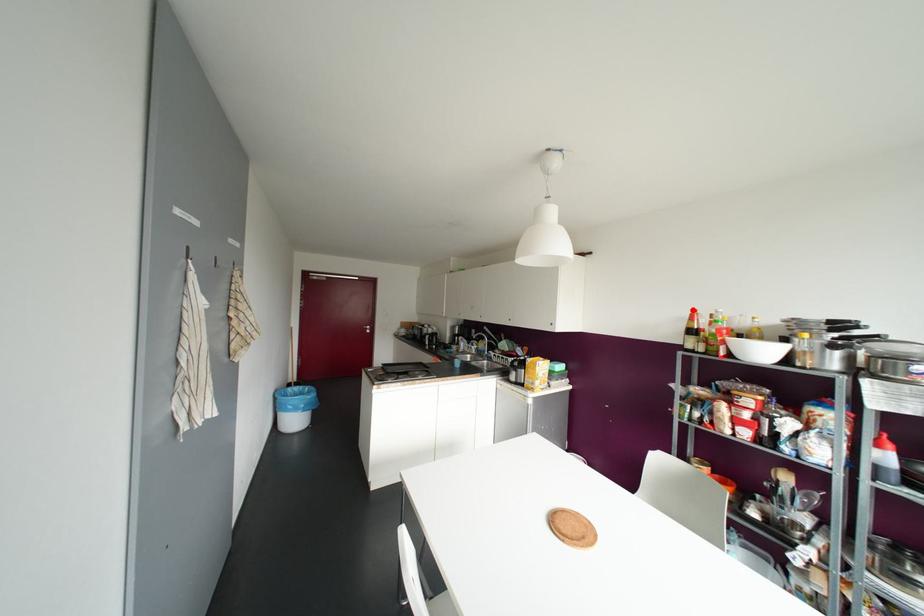
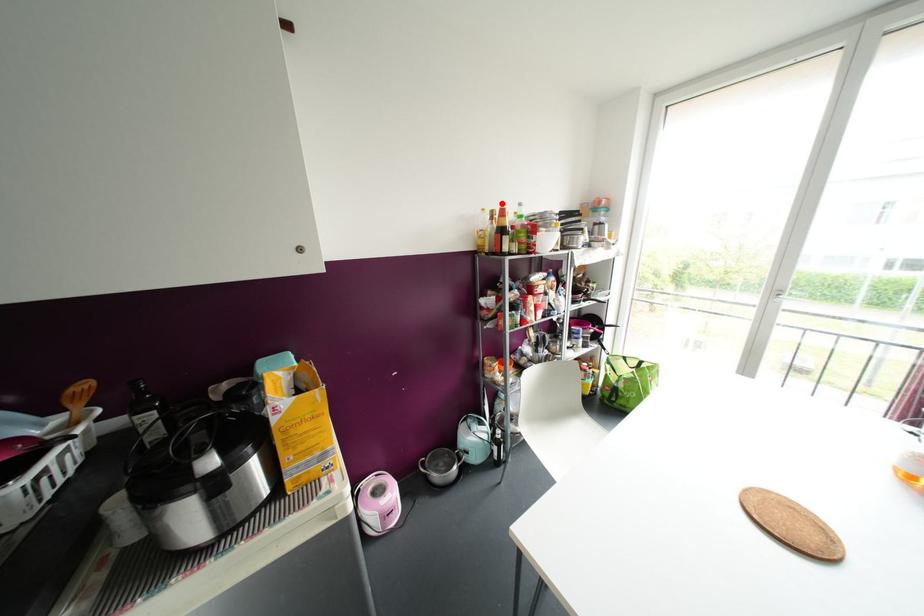
I am providing you with two images of the same scene from different viewpoints. A red point is marked on the first image and another point is marked on the second image. Are the points marked in image1 and image2 representing the same 3D position?

Yes